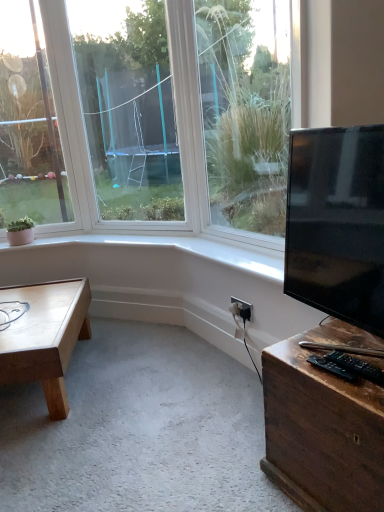
Find the location of a particular element. vacant space behind black plastic remote control at lower right, which is counted as the first wide, starting from the left is located at coordinates (305, 346).